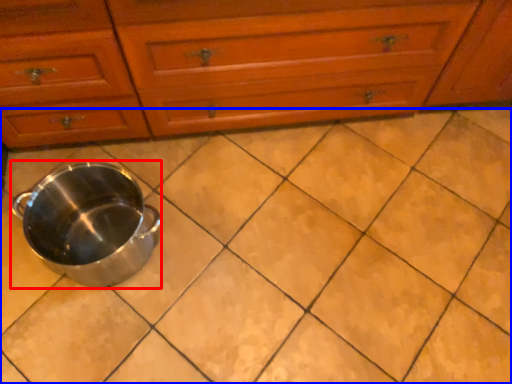
Question: Which object is closer to the camera taking this photo, crock pot (highlighted by a red box) or ceramic tile (highlighted by a blue box)?

Choices:
 (A) crock pot
 (B) ceramic tile

Answer: (A)